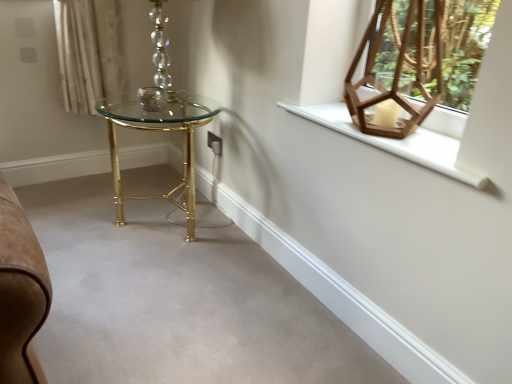
Measure the distance between point (366, 141) and camera.

Point (366, 141) is 1.22 meters from camera.

In order to click on wooden hexagonal lantern at upper right in this screenshot , I will do `click(394, 72)`.

In the scene shown: Does white wooden window sill at upper right have a larger size compared to matte glass candle holder at center?

Correct, white wooden window sill at upper right is larger in size than matte glass candle holder at center.

Does point (423, 142) come in front of point (155, 89)?

Yes, point (423, 142) is in front of point (155, 89).

Can you see white wooden window sill at upper right touching matte glass candle holder at center?

white wooden window sill at upper right and matte glass candle holder at center are not in contact.

Does wooden hexagonal lantern at upper right have a greater height compared to white wooden window sill at upper right?

Indeed, wooden hexagonal lantern at upper right has a greater height compared to white wooden window sill at upper right.

Is wooden hexagonal lantern at upper right located outside white wooden window sill at upper right?

Absolutely, wooden hexagonal lantern at upper right is external to white wooden window sill at upper right.

Is wooden hexagonal lantern at upper right aimed at white wooden window sill at upper right?

No.

Does wooden hexagonal lantern at upper right touch white wooden window sill at upper right?

No, wooden hexagonal lantern at upper right is not making contact with white wooden window sill at upper right.

Is gold metallic table at center aimed at wooden hexagonal lantern at upper right?

No, gold metallic table at center is not turned towards wooden hexagonal lantern at upper right.

Is gold metallic table at center inside or outside of wooden hexagonal lantern at upper right?

gold metallic table at center is not enclosed by wooden hexagonal lantern at upper right.

Is gold metallic table at center placed right next to wooden hexagonal lantern at upper right?

No.

Looking at this image, between gold metallic table at center and wooden hexagonal lantern at upper right, which one appears on the right side from the viewer's perspective?

wooden hexagonal lantern at upper right is more to the right.

Considering the sizes of objects wooden hexagonal lantern at upper right and matte glass candle holder at center in the image provided, who is taller, wooden hexagonal lantern at upper right or matte glass candle holder at center?

Standing taller between the two is wooden hexagonal lantern at upper right.

Based on the photo, is wooden hexagonal lantern at upper right positioned far away from matte glass candle holder at center?

They are positioned close to each other.

Considering the relative sizes of wooden hexagonal lantern at upper right and matte glass candle holder at center in the image provided, is wooden hexagonal lantern at upper right thinner than matte glass candle holder at center?

In fact, wooden hexagonal lantern at upper right might be wider than matte glass candle holder at center.

Is the depth of white wooden window sill at upper right greater than that of gold metallic table at center?

No, the depth of white wooden window sill at upper right is less than that of gold metallic table at center.

Does white wooden window sill at upper right appear on the left side of gold metallic table at center?

In fact, white wooden window sill at upper right is to the right of gold metallic table at center.

This screenshot has height=384, width=512. I want to click on window sill located on the right of gold metallic table at center, so click(x=395, y=141).

From the image's perspective, which is below, white wooden window sill at upper right or wooden hexagonal lantern at upper right?

white wooden window sill at upper right appears lower in the image.

Does white wooden window sill at upper right have a lesser height compared to wooden hexagonal lantern at upper right?

Yes.

Based on the photo, considering the sizes of objects white wooden window sill at upper right and wooden hexagonal lantern at upper right in the image provided, who is smaller, white wooden window sill at upper right or wooden hexagonal lantern at upper right?

With smaller size is white wooden window sill at upper right.

Consider the image. Can you confirm if white wooden window sill at upper right is positioned to the left of wooden hexagonal lantern at upper right?

No, white wooden window sill at upper right is not to the left of wooden hexagonal lantern at upper right.

The height and width of the screenshot is (384, 512). Find the location of `table lamp lying in front of the matte glass candle holder at center`. table lamp lying in front of the matte glass candle holder at center is located at coordinates (394, 72).

Can wooden hexagonal lantern at upper right be found inside matte glass candle holder at center?

No, wooden hexagonal lantern at upper right is not surrounded by matte glass candle holder at center.

Does point (150, 100) come closer to viewer compared to point (379, 134)?

No.

In the image, is matte glass candle holder at center positioned in front of or behind wooden hexagonal lantern at upper right?

Clearly, matte glass candle holder at center is behind wooden hexagonal lantern at upper right.

This screenshot has width=512, height=384. Find the location of `window sill on the right of the matte glass candle holder at center`. window sill on the right of the matte glass candle holder at center is located at coordinates (395, 141).

Where is `table lamp on the left of white wooden window sill at upper right`? The width and height of the screenshot is (512, 384). table lamp on the left of white wooden window sill at upper right is located at coordinates (394, 72).

Estimate the real-world distances between objects in this image. Which object is closer to wooden hexagonal lantern at upper right, matte glass candle holder at center or gold metallic table at center?

matte glass candle holder at center is positioned closer to the anchor wooden hexagonal lantern at upper right.

Based on their spatial positions, is gold metallic table at center or wooden hexagonal lantern at upper right further from matte glass candle holder at center?

The object further to matte glass candle holder at center is wooden hexagonal lantern at upper right.

Looking at the image, which one is located further to wooden hexagonal lantern at upper right, white wooden window sill at upper right or gold metallic table at center?

gold metallic table at center.

Based on their spatial positions, is gold metallic table at center or matte glass candle holder at center closer to white wooden window sill at upper right?

gold metallic table at center lies closer to white wooden window sill at upper right than the other object.

From the picture: Looking at the image, which one is located closer to gold metallic table at center, matte glass candle holder at center or white wooden window sill at upper right?

matte glass candle holder at center is positioned closer to the anchor gold metallic table at center.

When comparing their distances from white wooden window sill at upper right, does matte glass candle holder at center or gold metallic table at center seem closer?

gold metallic table at center is positioned closer to the anchor white wooden window sill at upper right.

When comparing their distances from gold metallic table at center, does wooden hexagonal lantern at upper right or white wooden window sill at upper right seem further?

Among the two, wooden hexagonal lantern at upper right is located further to gold metallic table at center.

Estimate the real-world distances between objects in this image. Which object is further from wooden hexagonal lantern at upper right, white wooden window sill at upper right or matte glass candle holder at center?

matte glass candle holder at center.

Find the location of a particular element. The image size is (512, 384). table situated between matte glass candle holder at center and wooden hexagonal lantern at upper right from left to right is located at coordinates (165, 131).

What are the coordinates of `table lamp between matte glass candle holder at center and white wooden window sill at upper right in the horizontal direction` in the screenshot? It's located at (394, 72).

Find the location of `table between matte glass candle holder at center and white wooden window sill at upper right`. table between matte glass candle holder at center and white wooden window sill at upper right is located at coordinates (165, 131).

You are a GUI agent. You are given a task and a screenshot of the screen. Output one action in this format:
    pyautogui.click(x=<x>, y=<y>)
    Task: Click on the table lamp between gold metallic table at center and white wooden window sill at upper right from left to right
    
    Given the screenshot: What is the action you would take?
    pyautogui.click(x=394, y=72)